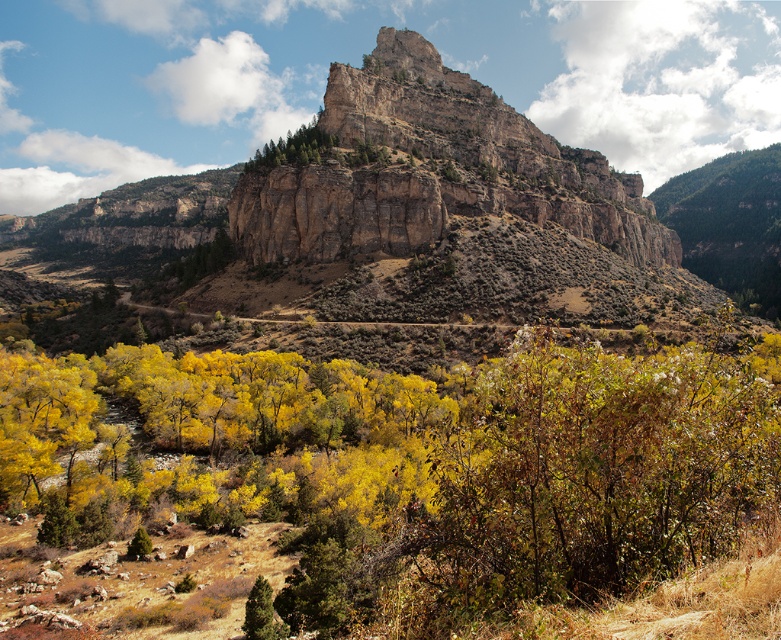
You are planning to set up a tent for a camping trip and need to choose between the rugged stone mountain at center and the green textured pine tree at upper center as a landmark. Which landmark would provide a wider base for setting up your tent?

The rugged stone mountain at center might be wider than the green textured pine tree at upper center, so it would provide a wider base for setting up your tent.

You are standing at the point labeled as point [432,216] in the image. Based on the scene description, what large natural feature are you directly facing?

The point [432,216] corresponds to the rugged stone mountain at center, so you are directly facing the rugged stone mountain at center.